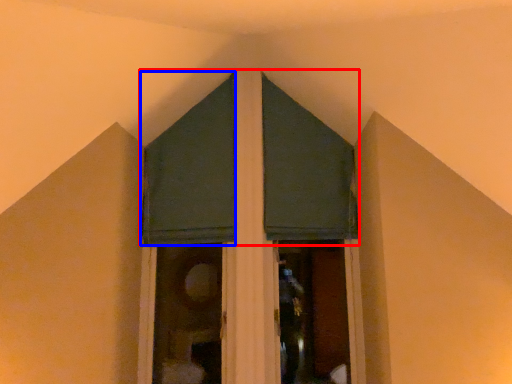
Question: Which of the following is the closest to the observer, curtain (highlighted by a red box) or curtain (highlighted by a blue box)?

Choices:
 (A) curtain
 (B) curtain

Answer: (A)